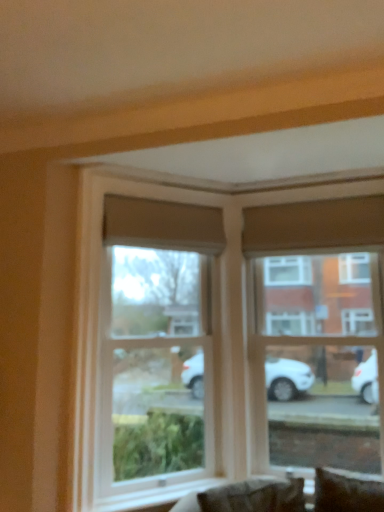
At what (x,y) coordinates should I click in order to perform the action: click on empty space that is ontop of clear glass window at center, marked as the second window in a right-to-left arrangement. Please return your answer as a coordinate pair (x, y). Image resolution: width=384 pixels, height=512 pixels. Looking at the image, I should click on (165, 183).